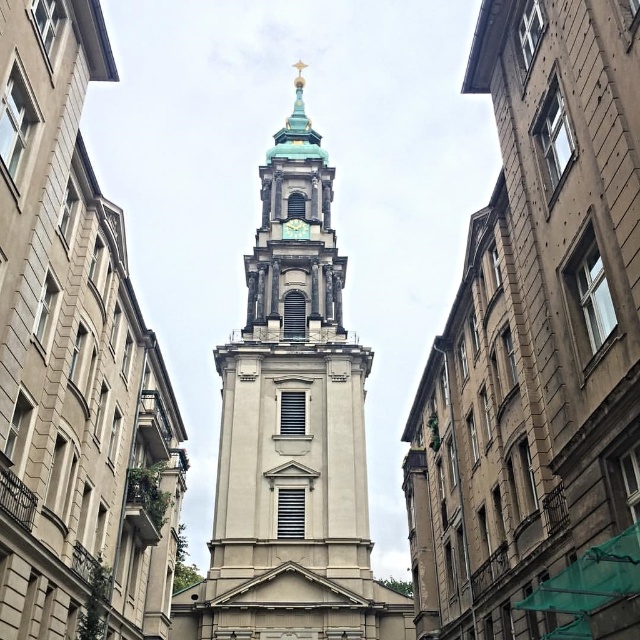
Question: Which object is closer to the camera taking this photo?

Choices:
 (A) gold metallic clock at center
 (B) white stone tower at center
 (C) white stone church tower at center

Answer: (C)

Question: Does white stone church at center lie in front of gold metallic clock at center?

Choices:
 (A) yes
 (B) no

Answer: (A)

Question: Can you confirm if white stone tower at center is wider than gold metallic clock at center?

Choices:
 (A) yes
 (B) no

Answer: (A)

Question: Based on their relative distances, which object is farther from the gold metallic clock at center?

Choices:
 (A) white stone church tower at center
 (B) white stone tower at center

Answer: (A)

Question: Which point is closer to the camera?

Choices:
 (A) white stone tower at center
 (B) gold metallic clock at center

Answer: (A)

Question: Is white stone tower at center below gold metallic clock at center?

Choices:
 (A) no
 (B) yes

Answer: (A)